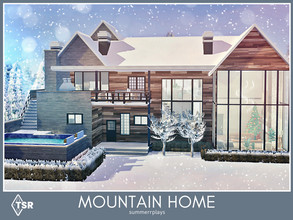
Identify the location of chimney. The image size is (293, 220). (206, 44), (102, 46).